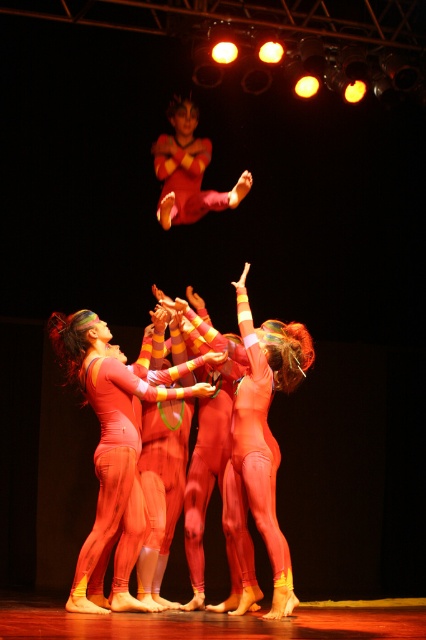
Question: Which point is closer to the camera?

Choices:
 (A) (198, 390)
 (B) (186, 209)

Answer: (A)

Question: Among these objects, which one is farthest from the camera?

Choices:
 (A) matte red leotard at upper center
 (B) matte orange leotard at center

Answer: (A)

Question: Can you confirm if matte orange leotard at center is smaller than matte red leotard at upper center?

Choices:
 (A) yes
 (B) no

Answer: (B)

Question: Where is matte orange leotard at center located in relation to matte red leotard at upper center in the image?

Choices:
 (A) above
 (B) below

Answer: (B)

Question: Is matte orange leotard at center closer to the viewer compared to matte red leotard at upper center?

Choices:
 (A) yes
 (B) no

Answer: (A)